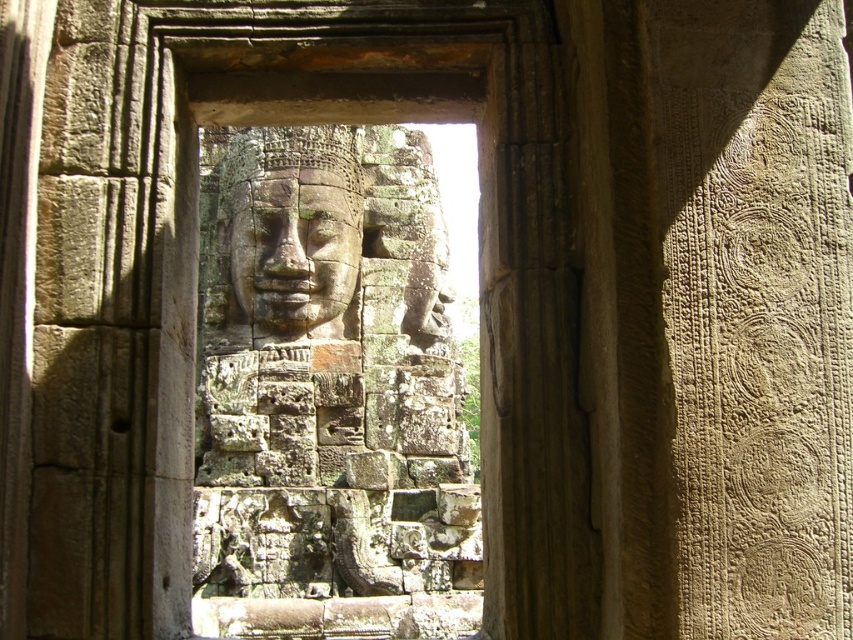
Is point (291, 406) closer to viewer compared to point (335, 332)?

Yes, point (291, 406) is in front of point (335, 332).

Between point (271, 394) and point (311, 316), which one is positioned in front?

Point (271, 394)

The width and height of the screenshot is (853, 640). Identify the location of weathered stone face at center. (328, 390).